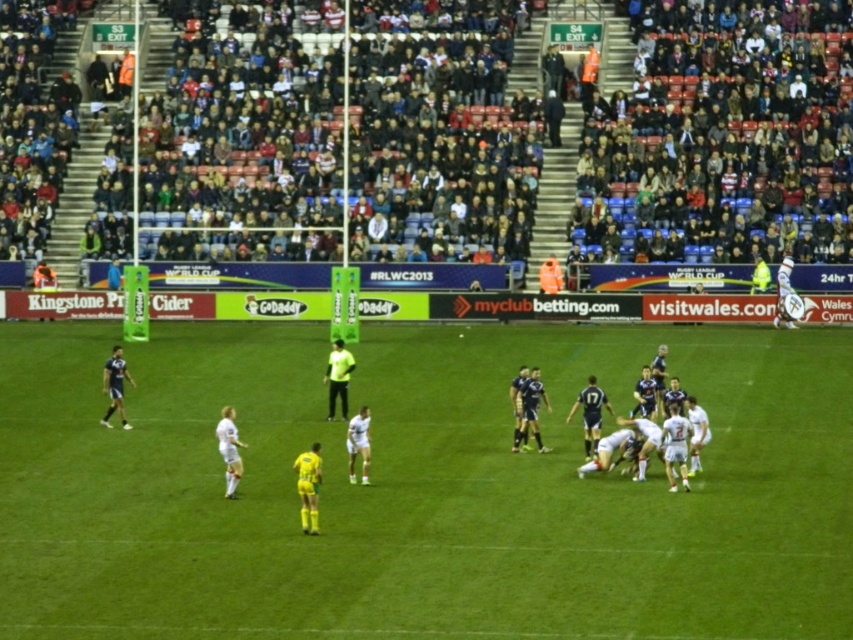
Is dark gray stadium seats at upper center bigger than dark blue jersey at center?

Correct, dark gray stadium seats at upper center is larger in size than dark blue jersey at center.

Which of these two, dark gray stadium seats at upper center or dark blue jersey at center, stands shorter?

Standing shorter between the two is dark blue jersey at center.

What do you see at coordinates (601, 131) in the screenshot? The width and height of the screenshot is (853, 640). I see `dark gray stadium seats at upper center` at bounding box center [601, 131].

I want to click on dark gray stadium seats at upper center, so tap(601, 131).

Based on the photo, who is taller, dark gray stadium seats at upper center or white jersey at center?

Standing taller between the two is dark gray stadium seats at upper center.

Between point (44, 214) and point (682, 452), which one is positioned behind?

Positioned behind is point (44, 214).

Is point (526, 131) closer to viewer compared to point (669, 416)?

No.

Find the location of a particular element. dark gray stadium seats at upper center is located at coordinates [x=601, y=131].

Is point (341, 381) farther from viewer compared to point (109, 369)?

Yes.

Who is positioned more to the right, neon yellow shirt at center or blue jersey at left?

neon yellow shirt at center

Is point (350, 355) positioned after point (106, 408)?

No, it is not.

I want to click on neon yellow shirt at center, so click(x=338, y=378).